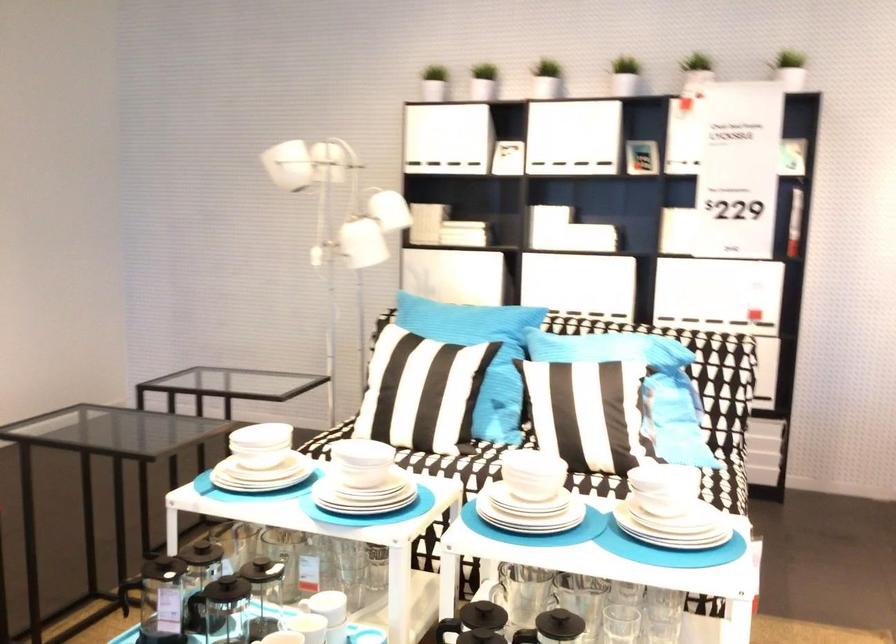
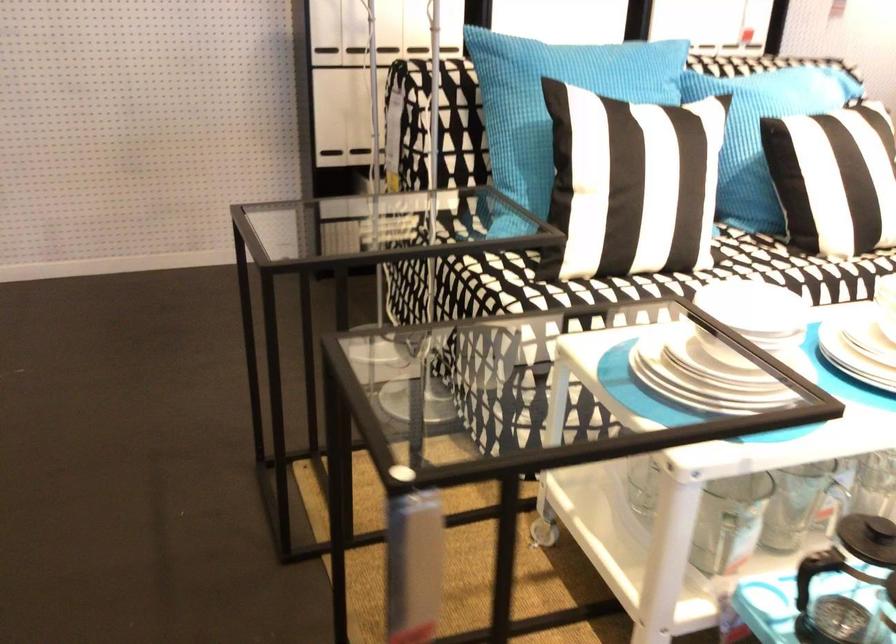
Find the pixel in the second image that matches point 392,379 in the first image.

(617, 180)